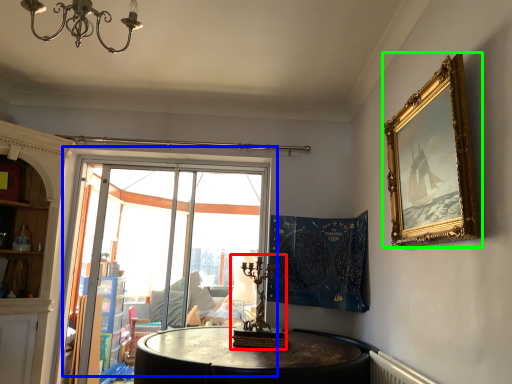
Question: Considering the real-world distances, which object is farthest from candle holder (highlighted by a red box)? window (highlighted by a blue box) or picture frame (highlighted by a green box)?

Choices:
 (A) window
 (B) picture frame

Answer: (A)